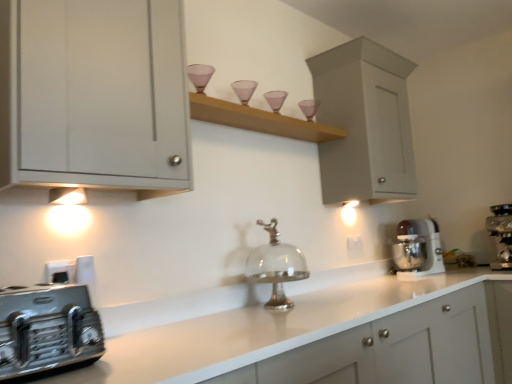
Question: Is the depth of silver metallic bell at center greater than that of white matte cabinet at upper right, which is counted as the 1th cabinetry, starting from the right?

Choices:
 (A) no
 (B) yes

Answer: (A)

Question: Does silver metallic bell at center lie in front of white matte cabinet at upper right, the second cabinetry when ordered from left to right?

Choices:
 (A) yes
 (B) no

Answer: (A)

Question: Is white matte cabinet at upper right, the 2th cabinetry positioned from the front, surrounded by silver metallic bell at center?

Choices:
 (A) no
 (B) yes

Answer: (A)

Question: Does silver metallic bell at center have a larger size compared to white matte cabinet at upper right, which is counted as the 1th cabinetry, starting from the right?

Choices:
 (A) yes
 (B) no

Answer: (B)

Question: From a real-world perspective, is silver metallic bell at center beneath white matte cabinet at upper right, the first cabinetry viewed from the back?

Choices:
 (A) no
 (B) yes

Answer: (B)

Question: Can you confirm if silver metallic bell at center is positioned to the right of white matte cabinet at upper right, which is counted as the 1th cabinetry, starting from the right?

Choices:
 (A) yes
 (B) no

Answer: (B)

Question: Is metallic stainless steel coffee maker at right, positioned as the second home appliance in front-to-back order, positioned with its back to white matte cabinet at upper right, the 2th cabinetry positioned from the front?

Choices:
 (A) yes
 (B) no

Answer: (B)

Question: Does metallic stainless steel coffee maker at right, positioned as the second home appliance in front-to-back order, have a greater height compared to white matte cabinet at upper right, the 2th cabinetry positioned from the front?

Choices:
 (A) no
 (B) yes

Answer: (A)

Question: From the image's perspective, is metallic stainless steel coffee maker at right, which is the 3th home appliance from left to right, under white matte cabinet at upper right, the second cabinetry when ordered from left to right?

Choices:
 (A) no
 (B) yes

Answer: (B)

Question: Is metallic stainless steel coffee maker at right, positioned as the second home appliance in front-to-back order, wider than white matte cabinet at upper right, the second cabinetry when ordered from left to right?

Choices:
 (A) no
 (B) yes

Answer: (B)

Question: Are metallic stainless steel coffee maker at right, which is counted as the second home appliance, starting from the back, and white matte cabinet at upper right, the 2th cabinetry positioned from the front, making contact?

Choices:
 (A) no
 (B) yes

Answer: (A)

Question: Can you confirm if metallic stainless steel coffee maker at right, the 1th home appliance from the right, is smaller than white matte cabinet at upper right, the 2th cabinetry positioned from the front?

Choices:
 (A) no
 (B) yes

Answer: (B)

Question: Is white plastic stand mixer at right, which is the 2th home appliance from right to left, facing towards metallic silver toaster at lower left, which ranks as the third home appliance in right-to-left order?

Choices:
 (A) yes
 (B) no

Answer: (B)